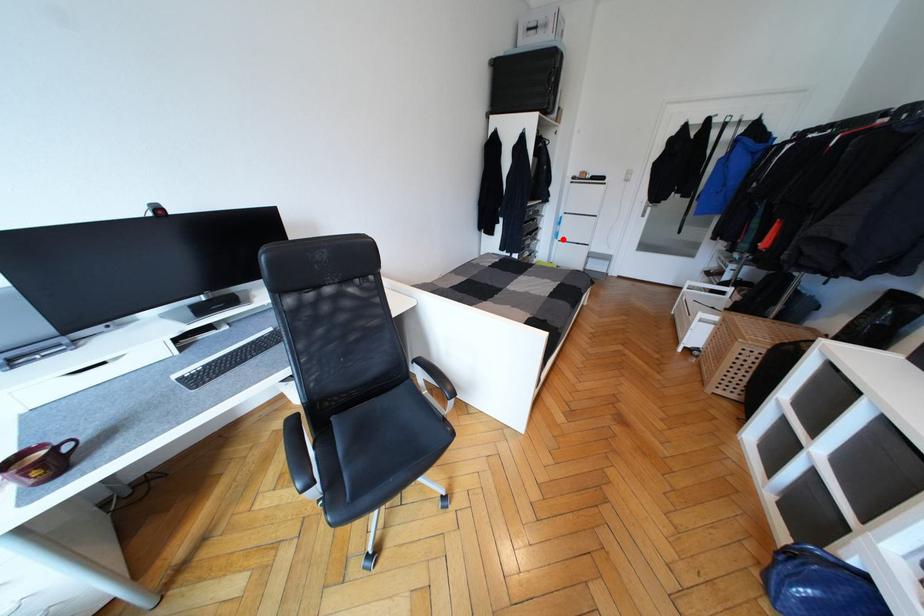
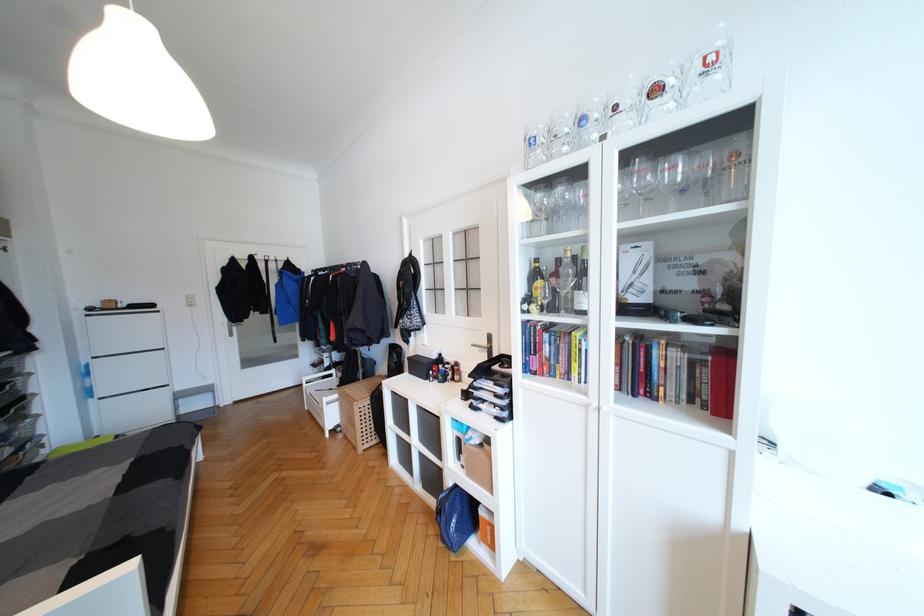
Question: I am providing you with two images of the same scene from different viewpoints. Image1 has a red point marked. In image2, the corresponding 3D location appears at what relative position? Reply with the corresponding letter.

Choices:
 (A) Closer
 (B) Farther

Answer: (B)